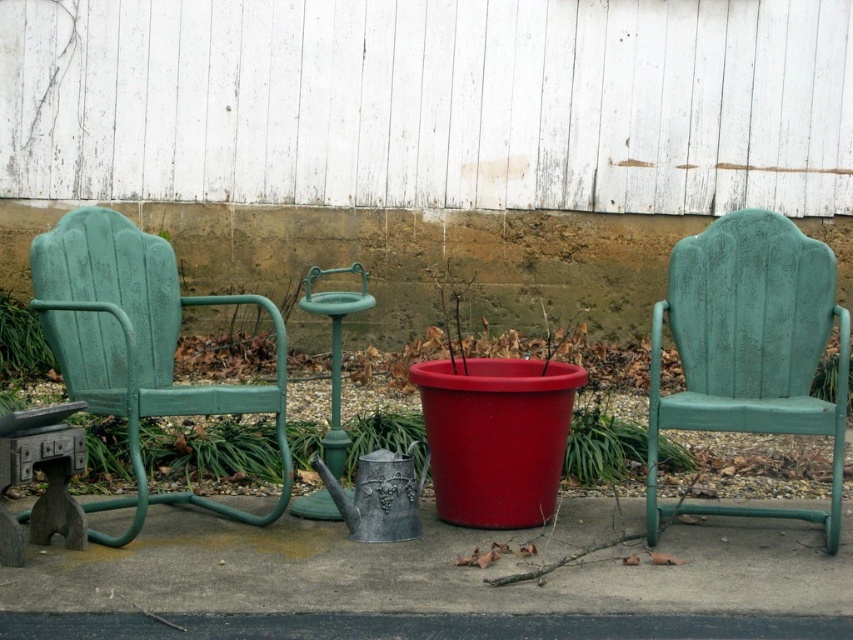
Between green distressed wood chair at right and green painted metal chair at left, which one is positioned higher?

green painted metal chair at left is higher up.

Is green distressed wood chair at right taller than green painted metal chair at left?

Yes, green distressed wood chair at right is taller than green painted metal chair at left.

Image resolution: width=853 pixels, height=640 pixels. What do you see at coordinates (749, 348) in the screenshot?
I see `green distressed wood chair at right` at bounding box center [749, 348].

Identify the location of green distressed wood chair at right. This screenshot has width=853, height=640. (749, 348).